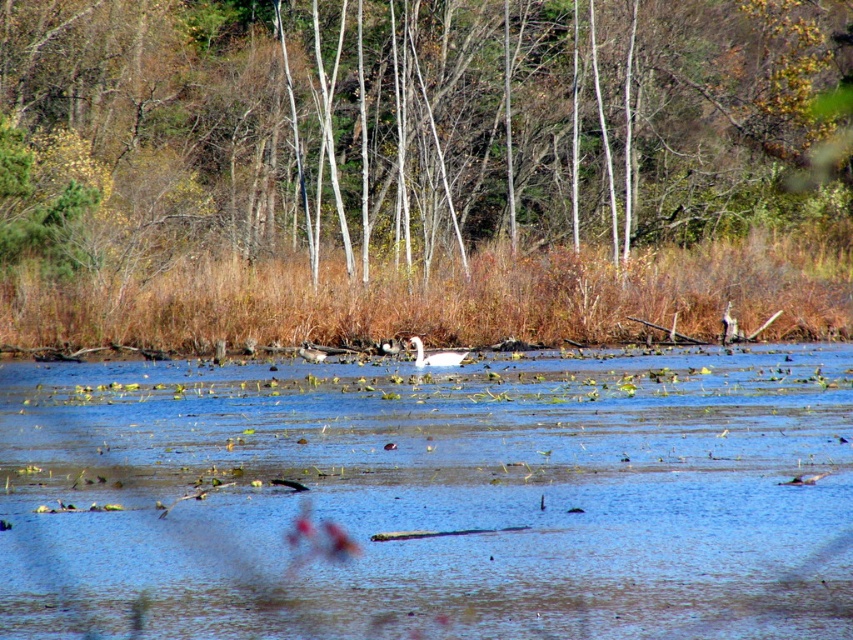
Question: Which point is farther to the camera?

Choices:
 (A) white glossy swan at center
 (B) clear blue water at center
 (C) brown bark trees at upper center

Answer: (C)

Question: Which point is farther from the camera taking this photo?

Choices:
 (A) (438, 360)
 (B) (747, 365)
 (C) (277, 188)

Answer: (C)

Question: Which of the following is the farthest from the observer?

Choices:
 (A) brown bark trees at upper center
 (B) clear blue water at center

Answer: (A)

Question: Does clear blue water at center appear over white glossy swan at center?

Choices:
 (A) yes
 (B) no

Answer: (B)

Question: Is brown bark trees at upper center below white glossy swan at center?

Choices:
 (A) no
 (B) yes

Answer: (A)

Question: Does clear blue water at center have a smaller size compared to brown bark trees at upper center?

Choices:
 (A) yes
 (B) no

Answer: (A)